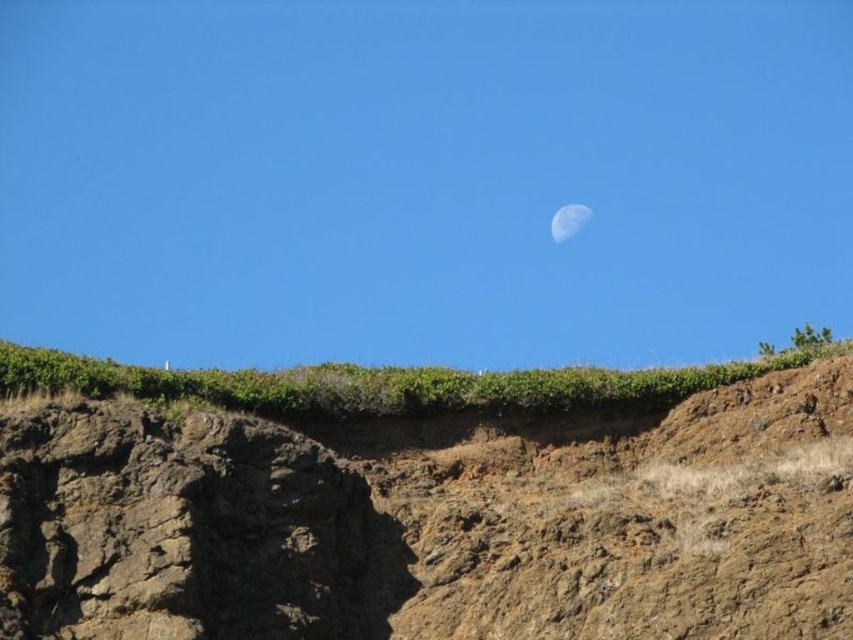
You are an astronaut on the moon and want to take a photo of the brown rocky cliff at upper center and the satin white moon at upper center. Which object will appear closer to the top of your camera view?

The satin white moon at upper center is positioned above the brown rocky cliff at upper center, so it will appear closer to the top of the camera view.

You are an astronaut on the moon who wants to climb the tallest object in the scene. Which object should you choose between the brown rocky cliff at upper center and the satin white moon at upper center?

The brown rocky cliff at upper center has a greater height compared to the satin white moon at upper center, so you should choose the brown rocky cliff at upper center to climb.